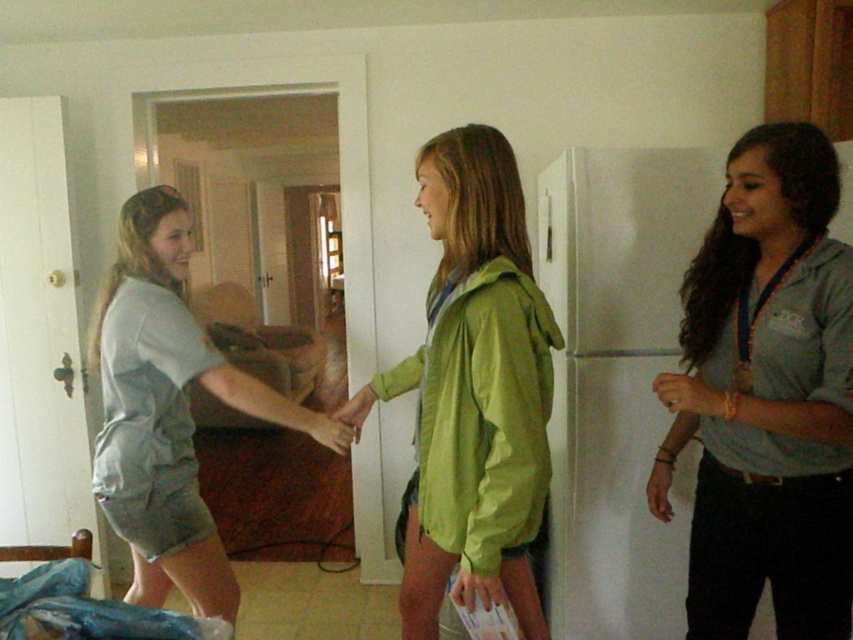
Question: Which of the following is the closest to the observer?

Choices:
 (A) (799, 300)
 (B) (335, 445)
 (C) (498, 132)

Answer: (A)

Question: Which object is farther from the camera taking this photo?

Choices:
 (A) green matte jacket at center
 (B) gray cotton shirt at left
 (C) matte green jacket at center
 (D) gray fabric shirt at right

Answer: (C)

Question: Observing the image, what is the correct spatial positioning of gray cotton shirt at left in reference to matte green jacket at center?

Choices:
 (A) below
 (B) above

Answer: (B)

Question: Can you confirm if gray fabric shirt at right is thinner than green matte jacket at center?

Choices:
 (A) yes
 (B) no

Answer: (A)

Question: Which point is farther to the camera?

Choices:
 (A) gray cotton shirt at left
 (B) green matte jacket at center
 (C) matte green jacket at center

Answer: (C)

Question: Is gray fabric shirt at right further to the viewer compared to matte green jacket at center?

Choices:
 (A) no
 (B) yes

Answer: (A)